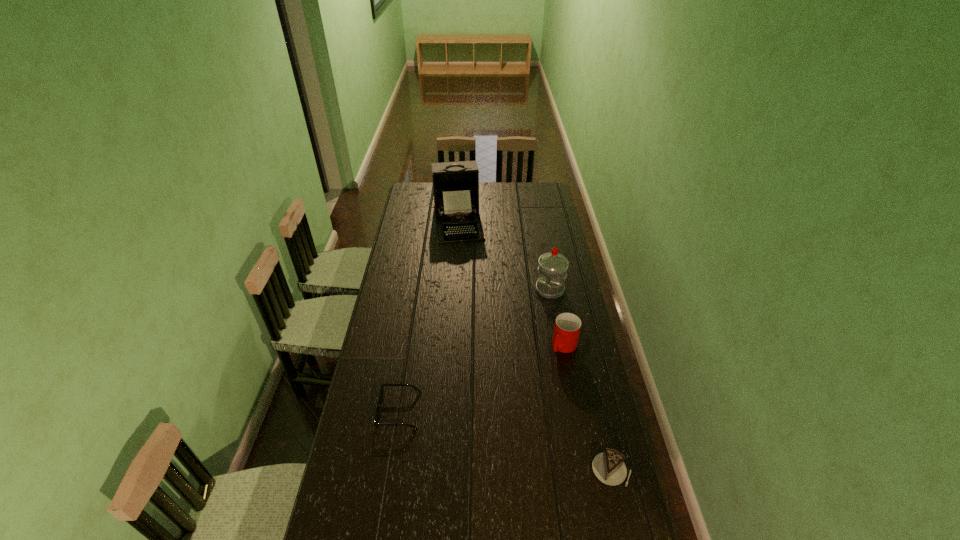
This screenshot has height=540, width=960. I want to click on the shortest object, so click(378, 409).

You are a GUI agent. You are given a task and a screenshot of the screen. Output one action in this format:
    pyautogui.click(x=<x>, y=<y>)
    Task: Click on the second nearest object
    
    Given the screenshot: What is the action you would take?
    pyautogui.click(x=378, y=409)

The image size is (960, 540). Find the location of `chocolate cake`. chocolate cake is located at coordinates (608, 467).

This screenshot has height=540, width=960. In order to click on the second shortest object in this screenshot , I will do `click(608, 467)`.

Where is `the third nearest object`? Image resolution: width=960 pixels, height=540 pixels. the third nearest object is located at coordinates (567, 327).

The image size is (960, 540). What are the coordinates of `the third shortest object` in the screenshot? It's located at (567, 327).

Image resolution: width=960 pixels, height=540 pixels. I want to click on the tallest object, so click(x=455, y=184).

Locate an element on the screen. Image resolution: width=960 pixels, height=540 pixels. typewriter is located at coordinates (455, 184).

Find the location of a particular element. the fourth nearest object is located at coordinates (552, 271).

At what (x,y) coordinates should I click in order to perform the action: click on the second tallest object. Please return your answer as a coordinate pair (x, y). This screenshot has width=960, height=540. Looking at the image, I should click on (552, 271).